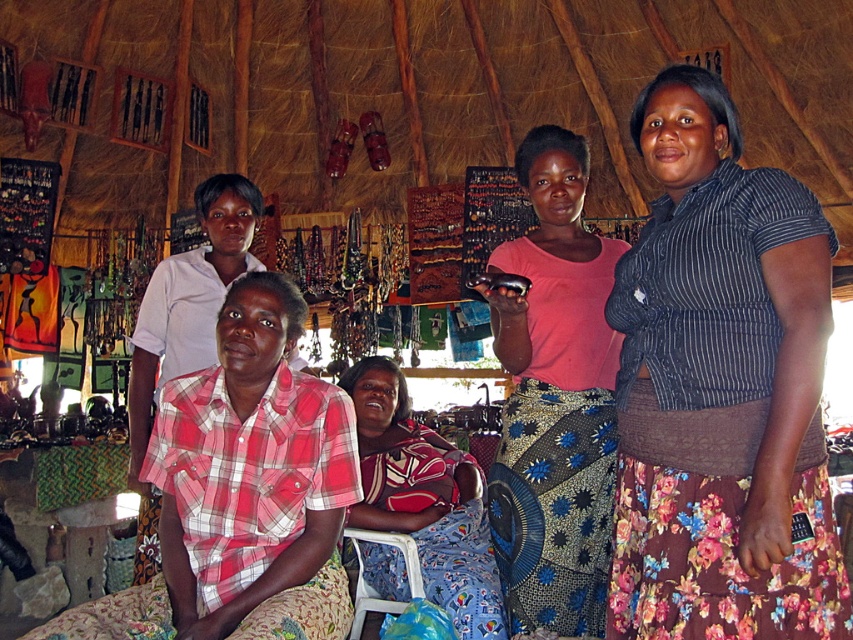
Question: Considering the relative positions of plaid cotton shirt at center and plaid fabric shirt at center in the image provided, where is plaid cotton shirt at center located with respect to plaid fabric shirt at center?

Choices:
 (A) above
 (B) below

Answer: (A)

Question: Which point is closer to the camera?

Choices:
 (A) [558, 424]
 (B) [688, 67]

Answer: (B)

Question: Among these points, which one is farthest from the camera?

Choices:
 (A) [280, 483]
 (B) [572, 285]
 (C) [379, 384]

Answer: (C)

Question: Can you confirm if striped fabric shirt at center is positioned above white plastic chair at lower center?

Choices:
 (A) yes
 (B) no

Answer: (A)

Question: Does plaid fabric shirt at center have a lesser width compared to white plastic chair at lower center?

Choices:
 (A) yes
 (B) no

Answer: (B)

Question: Which is nearer to the pink fabric skirt at center?

Choices:
 (A) plaid cotton shirt at center
 (B) striped fabric shirt at center

Answer: (B)